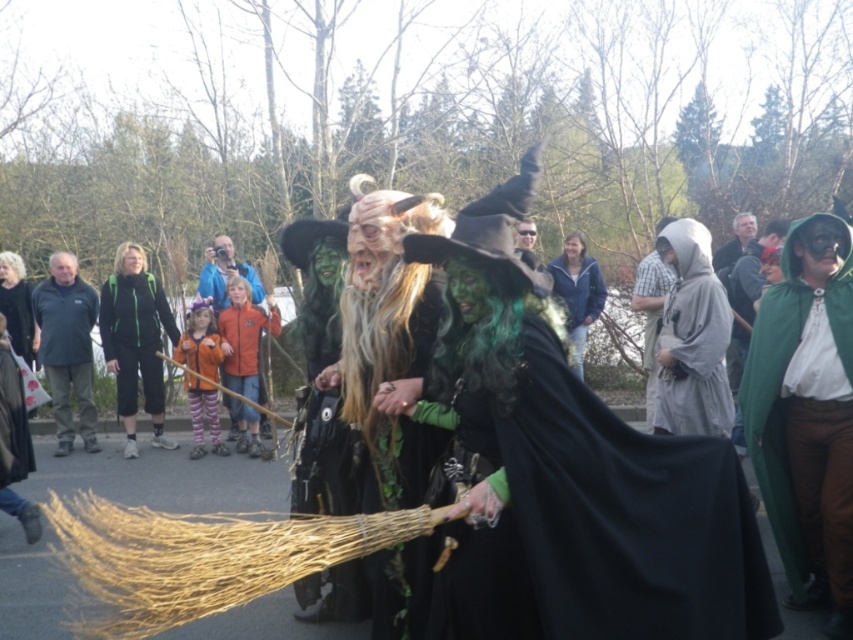
Who is positioned more to the right, orange fleece jacket at center or blue fabric jacket at center?

From the viewer's perspective, orange fleece jacket at center appears more on the right side.

Who is lower down, orange fleece jacket at center or blue fabric jacket at center?

Positioned lower is orange fleece jacket at center.

Is point (242, 358) farther from camera compared to point (202, 273)?

No, (242, 358) is closer to viewer.

At what (x,y) coordinates should I click in order to perform the action: click on orange fleece jacket at center. Please return your answer as a coordinate pair (x, y). The height and width of the screenshot is (640, 853). Looking at the image, I should click on (242, 337).

Does dark green fleece jacket at left appear on the right side of green fabric hood at center?

In fact, dark green fleece jacket at left is to the left of green fabric hood at center.

Is dark green fleece jacket at left shorter than green fabric hood at center?

No, dark green fleece jacket at left is not shorter than green fabric hood at center.

Is point (84, 323) in front of point (741, 433)?

No, (84, 323) is further to viewer.

This screenshot has height=640, width=853. I want to click on dark green fleece jacket at left, so click(x=67, y=348).

Which is below, green fleece jacket at left or orange fleece jacket at center?

Positioned lower is orange fleece jacket at center.

Is point (128, 369) positioned before point (245, 360)?

Yes, point (128, 369) is in front of point (245, 360).

Which is in front, point (131, 310) or point (248, 348)?

Positioned in front is point (131, 310).

Locate an element on the screen. This screenshot has height=640, width=853. green fleece jacket at left is located at coordinates (135, 340).